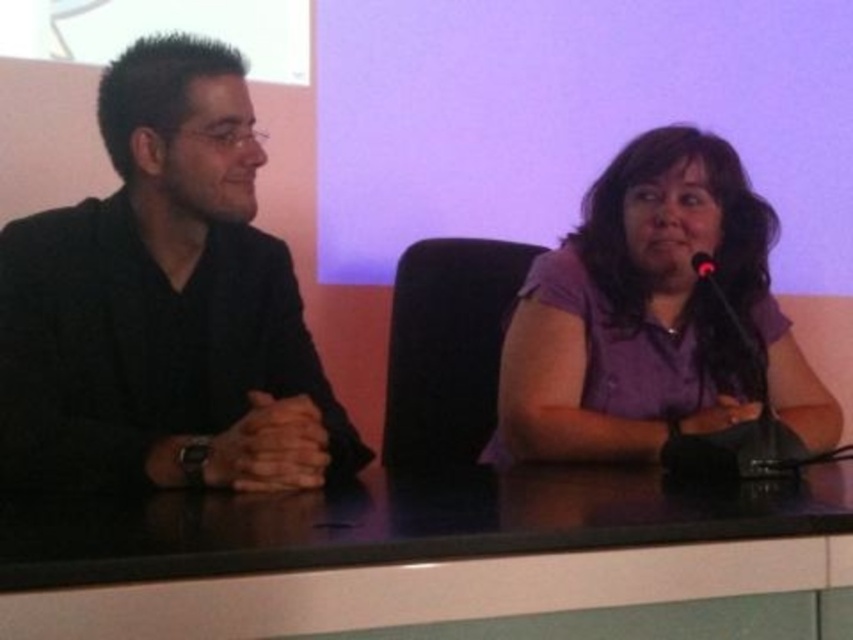
Which is above, black matte shirt at left or black matte microphone at right?

Positioned higher is black matte microphone at right.

Does black matte shirt at left appear under black matte microphone at right?

Correct, black matte shirt at left is located below black matte microphone at right.

Does point (276, 422) come behind point (708, 257)?

No, (276, 422) is closer to viewer.

This screenshot has height=640, width=853. What are the coordinates of `black matte shirt at left` in the screenshot? It's located at (164, 305).

Is black matte shirt at left below black glossy table at center?

No.

Does black matte shirt at left appear on the right side of black glossy table at center?

Incorrect, black matte shirt at left is not on the right side of black glossy table at center.

At what (x,y) coordinates should I click in order to perform the action: click on black matte shirt at left. Please return your answer as a coordinate pair (x, y). The image size is (853, 640). Looking at the image, I should click on (164, 305).

Which is behind, point (144, 156) or point (653, 349)?

The point (653, 349) is behind.

Who is more distant from viewer, (231, 157) or (665, 221)?

The point (665, 221) is behind.

Where is `black matte shirt at left`? black matte shirt at left is located at coordinates (164, 305).